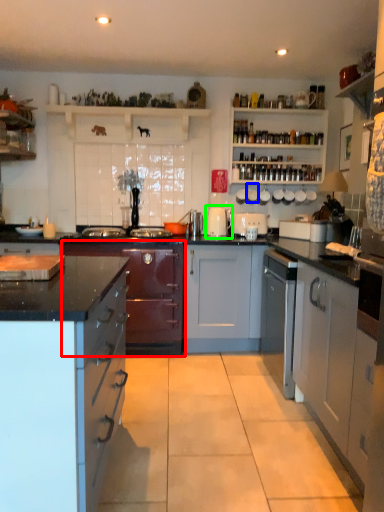
Question: Based on their relative distances, which object is farther from cabinetry (highlighted by a red box)? Choose from appliance (highlighted by a blue box) and appliance (highlighted by a green box).

Choices:
 (A) appliance
 (B) appliance

Answer: (A)